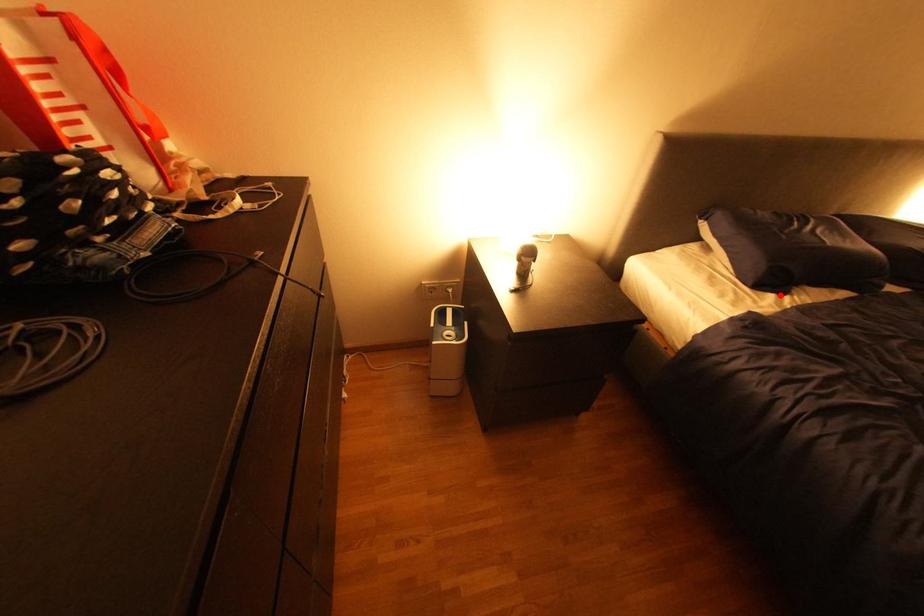
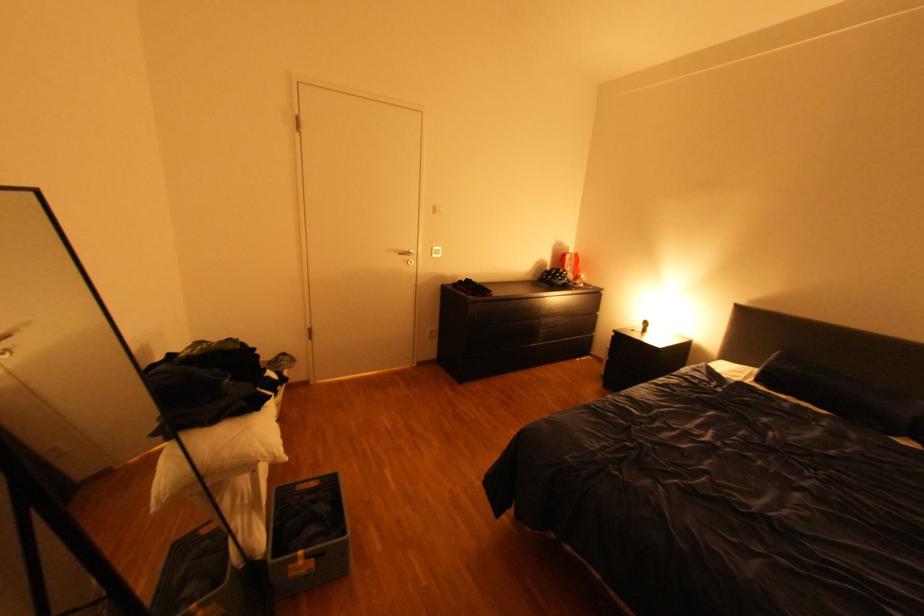
Where in the second image is the point corresponding to the highlighted location from the first image?

(771, 387)